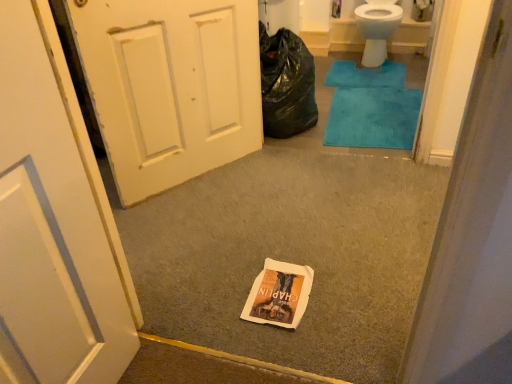
Where is `free spot above white paper bag at center (from a real-world perspective)`? Image resolution: width=512 pixels, height=384 pixels. free spot above white paper bag at center (from a real-world perspective) is located at coordinates (279, 287).